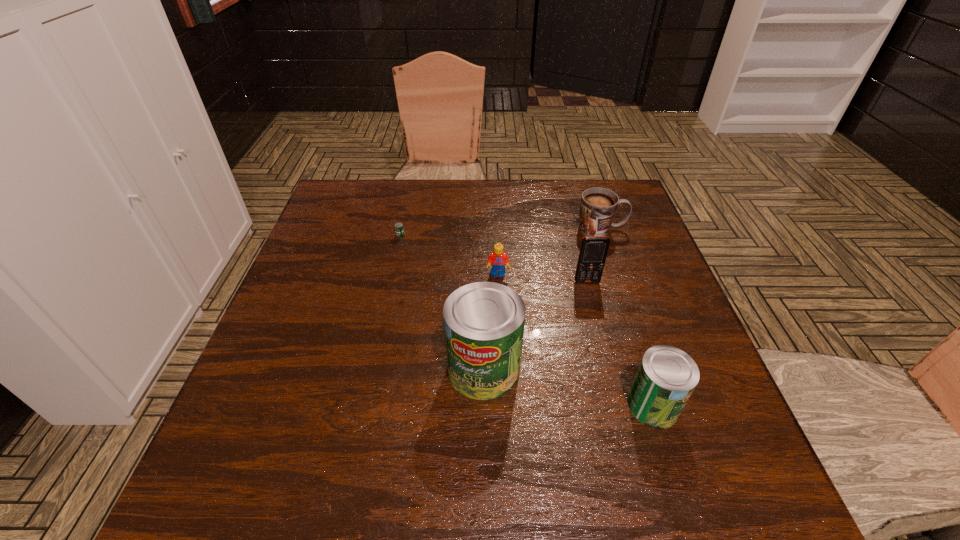
Locate an element on the screen. vacant space at the far edge is located at coordinates (498, 202).

The image size is (960, 540). In order to click on free space at the near edge of the desktop in this screenshot , I will do `click(516, 429)`.

Locate an element on the screen. This screenshot has height=540, width=960. vacant space at the left edge of the desktop is located at coordinates (341, 234).

In the image, there is a desktop. Identify the location of vacant space at the right edge. The height and width of the screenshot is (540, 960). (655, 254).

Identify the location of blank space at the far left corner of the desktop. Image resolution: width=960 pixels, height=540 pixels. (373, 205).

At what (x,y) coordinates should I click in order to perform the action: click on vacant area at the near left corner. Please return your answer as a coordinate pair (x, y). Image resolution: width=960 pixels, height=540 pixels. Looking at the image, I should click on (252, 407).

This screenshot has height=540, width=960. I want to click on vacant space that's between the third farthest object and the leftmost object, so click(x=449, y=255).

Where is `free space between the taller can and the shortest object`? This screenshot has height=540, width=960. free space between the taller can and the shortest object is located at coordinates (442, 302).

This screenshot has height=540, width=960. I want to click on blank region between the left can and the right can, so click(568, 387).

Locate an element on the screen. Image resolution: width=960 pixels, height=540 pixels. empty space between the right can and the beer can is located at coordinates (527, 320).